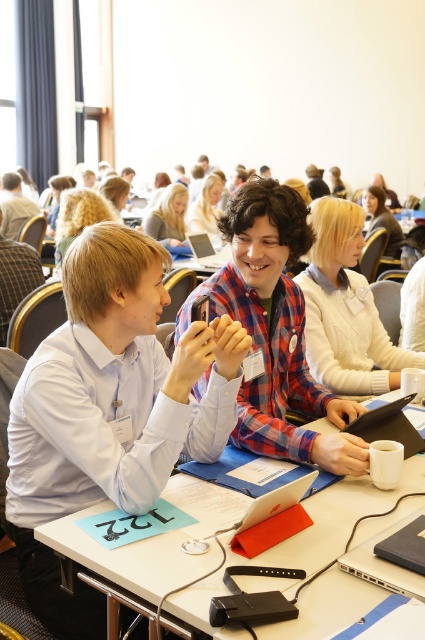
You are a photographer standing at the back of the room. You want to take a photo of both the plaid fabric shirt at center and the white knit sweater at center in the same frame. Considering your camera has a minimum focus distance of 15 inches, will you be able to capture both subjects clearly without moving closer?

The plaid fabric shirt at center is 17.14 inches from the white knit sweater at center. Since the distance between them is greater than the camera minimum focus distance of 15 inches, you can capture both subjects clearly without moving closer.

You are an observer standing at the entrance of the room. You see two people sitting at a table in the center. Both are wearing the plaid fabric shirt at center and the white knit sweater at center. Which clothing item is closer to the floor?

The plaid fabric shirt at center is below the white knit sweater at center, so the plaid fabric shirt at center is closer to the floor.

You are organizing a clothing display and need to arrange the plaid fabric shirt at center and the white knit sweater at center side by side. Based on their widths, which should be placed on the left to maximize space utilization?

The plaid fabric shirt at center has a greater width than the white knit sweater at center. To maximize space utilization, place the wider plaid fabric shirt at center on the left so it occupies more space on that side.